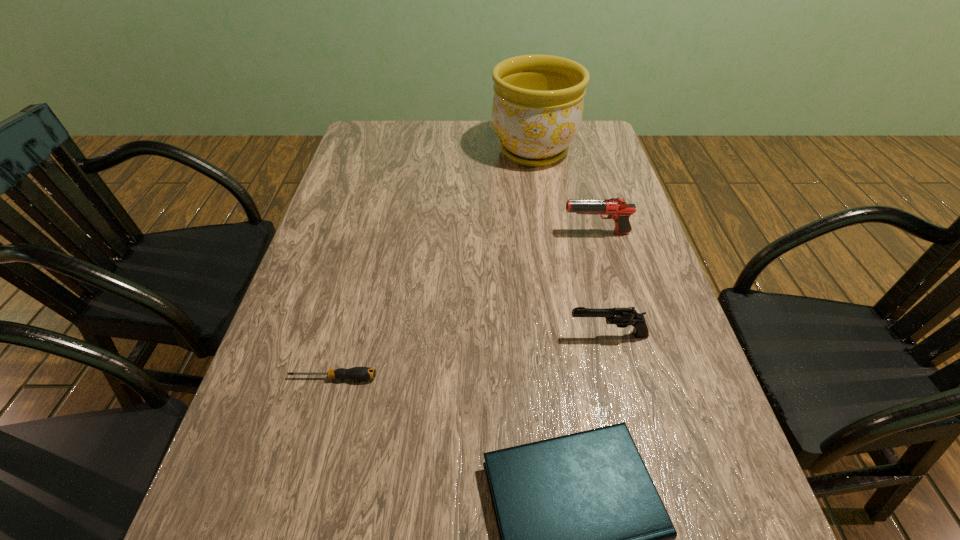
Identify which object is the third nearest to the nearest object. Please provide its 2D coordinates. Your answer should be formatted as a tuple, i.e. [(x, y)], where the tuple contains the x and y coordinates of a point satisfying the conditions above.

[(618, 209)]

Where is `object that can be found as the third closest to the fourth tallest object`? The height and width of the screenshot is (540, 960). object that can be found as the third closest to the fourth tallest object is located at coordinates (618, 209).